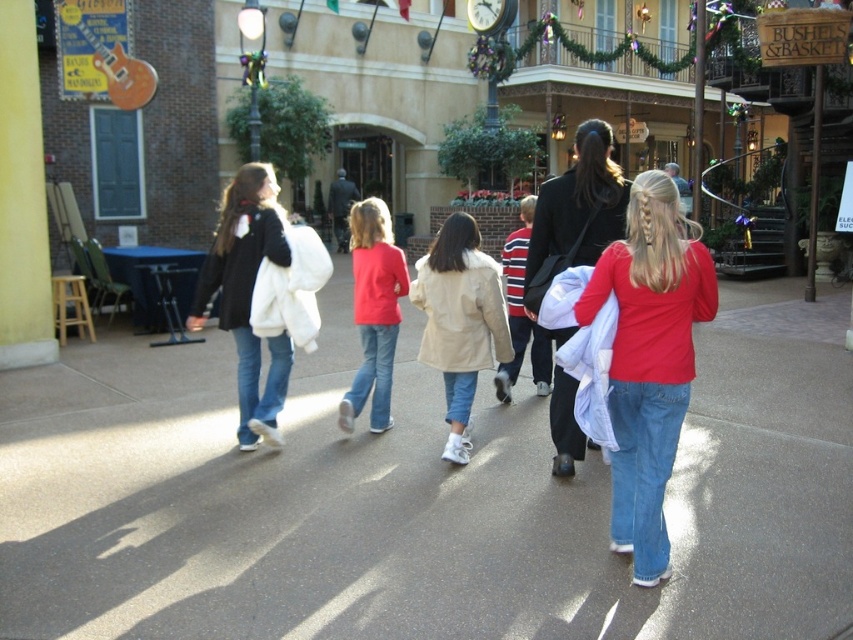
You are standing on the smooth concrete pavement at center and want to pick up the matte black coat at center. How many steps forward do you need to take to reach it?

The smooth concrete pavement at center is closer to the viewer than the matte black coat at center, so you need to take steps backward to reach it.

You are standing at the starting point and want to reach the destination point. The two points you see are point (685,310) and point (492,348). Which point is closer to you?

Point (685,310) is in front of point (492,348), so the point closer to you is point (685,310).